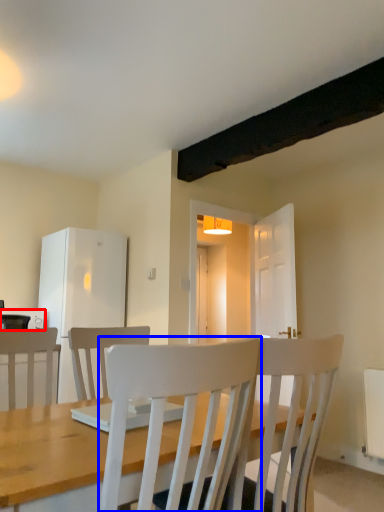
Question: Among these objects, which one is farthest to the camera, appliance (highlighted by a red box) or chair (highlighted by a blue box)?

Choices:
 (A) appliance
 (B) chair

Answer: (A)